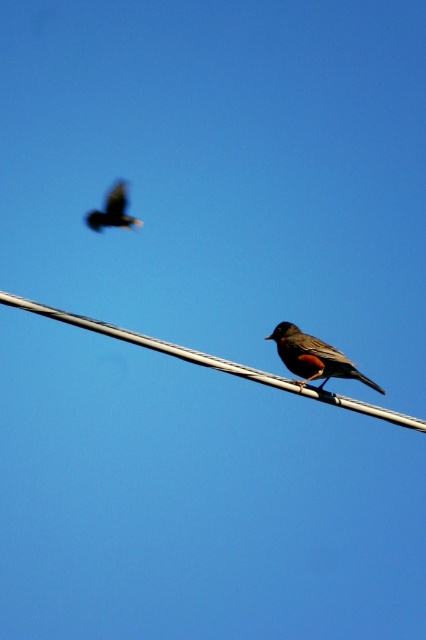
You are a photographer aiming to capture the brown matte bird at center. You notice a point marked at coordinates (313, 356) in the image. Where is this point located relative to the bird?

The point marked at coordinates (313, 356) is located at the brown matte bird at center.

You are a birdwatcher trying to capture a clear photo of the brown matte bird at center perched on the metallic wire at center. Considering the size difference between the two, which object will appear bigger in your camera viewfinder?

The metallic wire at center appears larger in the camera viewfinder than the brown matte bird at center because the metallic wire at center is larger in size than the brown matte bird at center according to the description.